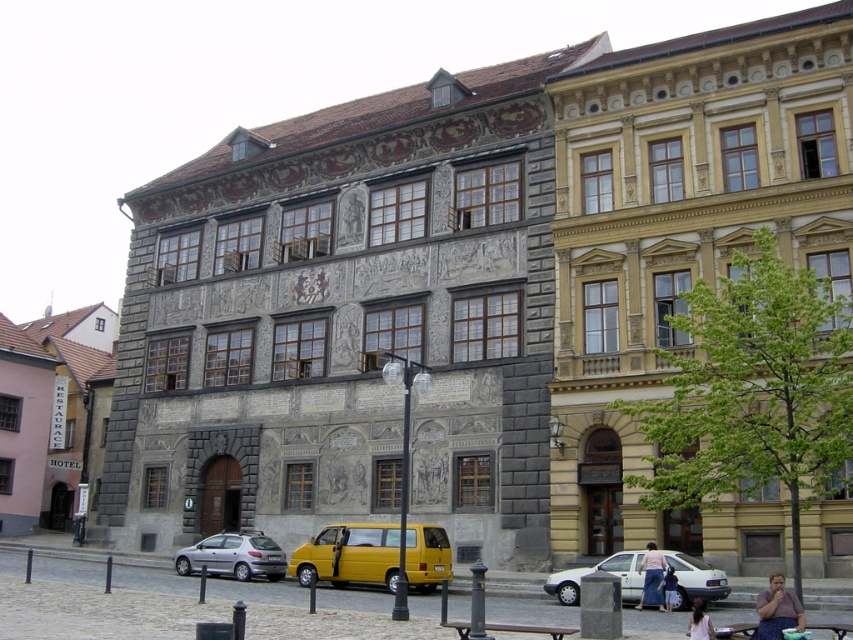
You are standing in front of the historic building and see both the silver metallic hatchback at lower left and the light brown leather jacket at lower center. Which object is closer to you?

The silver metallic hatchback at lower left is closer to you since it is further to the viewer than the light brown leather jacket at lower center.

You are standing in front of the historic building and notice a matte pink shirt at lower right. Where exactly is the matte pink shirt located in relation to the building?

The matte pink shirt at lower right is located at the coordinates point (776, 609) relative to the building.

You are a fashion designer observing a model in a historic building. You notice the denim skirt at lower right and the light brown hair at lower center. Which item has a smaller size?

The denim skirt at lower right has a smaller size compared to the light brown hair at lower center.